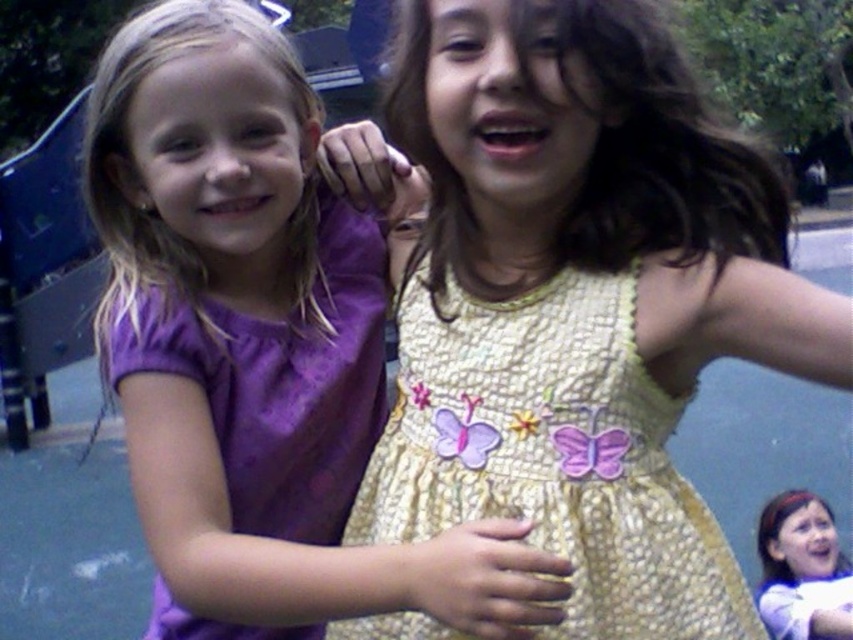
Question: Among these objects, which one is farthest from the camera?

Choices:
 (A) matte purple dress at center
 (B) purple satin dress at center

Answer: (A)

Question: Is yellow textured dress at center below matte purple dress at center?

Choices:
 (A) no
 (B) yes

Answer: (A)

Question: Can you confirm if purple satin dress at center is wider than yellow textured dress at center?

Choices:
 (A) no
 (B) yes

Answer: (B)

Question: Does purple satin dress at center appear under matte purple dress at center?

Choices:
 (A) yes
 (B) no

Answer: (B)

Question: Considering the real-world distances, which object is closest to the yellow textured dress at center?

Choices:
 (A) matte purple dress at center
 (B) purple satin dress at center

Answer: (B)

Question: Which object is farther from the camera taking this photo?

Choices:
 (A) yellow textured dress at center
 (B) purple satin dress at center

Answer: (A)